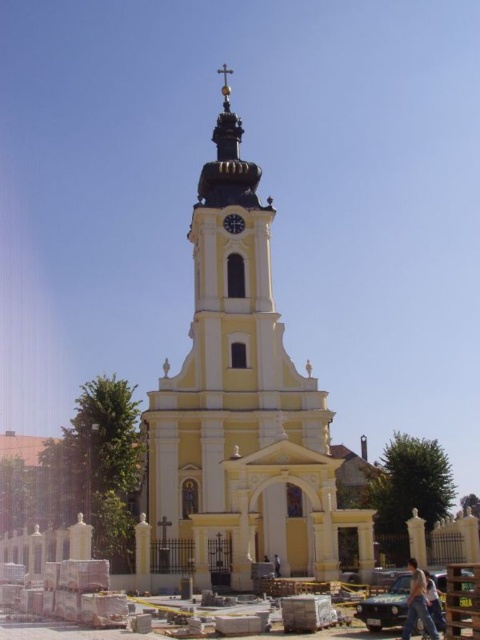
Question: Which point is farther to the camera?

Choices:
 (A) (278, 573)
 (B) (235, 234)

Answer: (B)

Question: Can you confirm if yellow matte tower at center is positioned to the left of brown leather bag at center?

Choices:
 (A) yes
 (B) no

Answer: (A)

Question: Estimate the real-world distances between objects in this image. Which object is farther from the brown leather bag at center?

Choices:
 (A) jeans at lower right
 (B) light blue jeans at lower right

Answer: (A)

Question: Does jeans at lower right appear on the right side of metallic clock at upper center?

Choices:
 (A) no
 (B) yes

Answer: (B)

Question: Among these objects, which one is nearest to the camera?

Choices:
 (A) light blue jeans at lower right
 (B) jeans at lower right
 (C) yellow matte tower at center
 (D) brown leather bag at center

Answer: (B)

Question: Can you confirm if yellow matte tower at center is thinner than metallic clock at upper center?

Choices:
 (A) no
 (B) yes

Answer: (A)